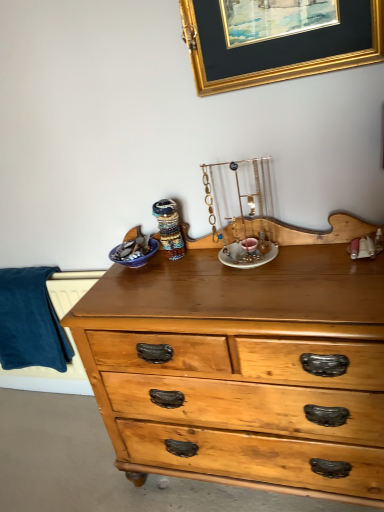
What is the approximate width of gold/glossy picture frame at upper center?

The width of gold/glossy picture frame at upper center is 2.65 inches.

The width and height of the screenshot is (384, 512). Describe the element at coordinates (278, 39) in the screenshot. I see `gold/glossy picture frame at upper center` at that location.

I want to click on gold/glossy picture frame at upper center, so click(278, 39).

Where is `blue soft fabric at left`? This screenshot has width=384, height=512. blue soft fabric at left is located at coordinates pos(30,321).

Describe the element at coordinates (30, 321) in the screenshot. I see `blue soft fabric at left` at that location.

Identify the location of gold/glossy picture frame at upper center. (278, 39).

Which is more to the right, blue soft fabric at left or gold/glossy picture frame at upper center?

gold/glossy picture frame at upper center.

Is the depth of blue soft fabric at left less than that of gold/glossy picture frame at upper center?

That is False.

Between point (19, 330) and point (196, 87), which one is positioned in front?

Point (196, 87)

From the image's perspective, is blue soft fabric at left positioned above or below gold/glossy picture frame at upper center?

Based on their image positions, blue soft fabric at left is located beneath gold/glossy picture frame at upper center.

From a real-world perspective, is blue soft fabric at left positioned above or below gold/glossy picture frame at upper center?

blue soft fabric at left is situated lower than gold/glossy picture frame at upper center in the real world.

Does blue soft fabric at left have a greater width compared to gold/glossy picture frame at upper center?

Yes, blue soft fabric at left is wider than gold/glossy picture frame at upper center.

Between blue soft fabric at left and gold/glossy picture frame at upper center, which one has less height?

gold/glossy picture frame at upper center.

Considering the relative sizes of blue soft fabric at left and gold/glossy picture frame at upper center in the image provided, is blue soft fabric at left smaller than gold/glossy picture frame at upper center?

No, blue soft fabric at left is not smaller than gold/glossy picture frame at upper center.

Is blue soft fabric at left inside or outside of gold/glossy picture frame at upper center?

blue soft fabric at left is not inside gold/glossy picture frame at upper center, it's outside.

Are blue soft fabric at left and gold/glossy picture frame at upper center far apart?

Yes.

Is blue soft fabric at left aimed at gold/glossy picture frame at upper center?

No, blue soft fabric at left is not turned towards gold/glossy picture frame at upper center.

How many degrees apart are the facing directions of blue soft fabric at left and gold/glossy picture frame at upper center?

The angle between the facing direction of blue soft fabric at left and the facing direction of gold/glossy picture frame at upper center is 0.00813 degrees.

You are a GUI agent. You are given a task and a screenshot of the screen. Output one action in this format:
    pyautogui.click(x=<x>, y=<y>)
    Task: Click on the blanket below the gold/glossy picture frame at upper center (from a real-world perspective)
    The width and height of the screenshot is (384, 512).
    Given the screenshot: What is the action you would take?
    pyautogui.click(x=30, y=321)

Can you confirm if gold/glossy picture frame at upper center is positioned to the right of blue soft fabric at left?

Yes, gold/glossy picture frame at upper center is to the right of blue soft fabric at left.

Which object is further away from the camera, gold/glossy picture frame at upper center or blue soft fabric at left?

blue soft fabric at left is behind.

Consider the image. Which point is more forward, (277, 3) or (35, 330)?

Point (277, 3)

From the image's perspective, is gold/glossy picture frame at upper center on blue soft fabric at left?

Yes, from the image's perspective, gold/glossy picture frame at upper center is on top of blue soft fabric at left.

From a real-world perspective, does gold/glossy picture frame at upper center sit lower than blue soft fabric at left?

No, from a real-world perspective, gold/glossy picture frame at upper center is not under blue soft fabric at left.

Considering the sizes of objects gold/glossy picture frame at upper center and blue soft fabric at left in the image provided, who is wider, gold/glossy picture frame at upper center or blue soft fabric at left?

Wider between the two is blue soft fabric at left.

Considering the sizes of objects gold/glossy picture frame at upper center and blue soft fabric at left in the image provided, who is shorter, gold/glossy picture frame at upper center or blue soft fabric at left?

Standing shorter between the two is gold/glossy picture frame at upper center.

Considering the sizes of gold/glossy picture frame at upper center and blue soft fabric at left in the image, is gold/glossy picture frame at upper center bigger or smaller than blue soft fabric at left?

gold/glossy picture frame at upper center is smaller than blue soft fabric at left.

Can we say gold/glossy picture frame at upper center lies outside blue soft fabric at left?

gold/glossy picture frame at upper center is positioned outside blue soft fabric at left.

Consider the image. Are gold/glossy picture frame at upper center and blue soft fabric at left making contact?

No, gold/glossy picture frame at upper center is not touching blue soft fabric at left.

Is gold/glossy picture frame at upper center oriented towards blue soft fabric at left?

No, gold/glossy picture frame at upper center is not facing towards blue soft fabric at left.

What's the angular difference between gold/glossy picture frame at upper center and blue soft fabric at left's facing directions?

0.00813 degrees.

How far apart are gold/glossy picture frame at upper center and blue soft fabric at left?

They are 4.00 feet apart.

The height and width of the screenshot is (512, 384). What are the coordinates of `picture frame lying above the blue soft fabric at left (from the image's perspective)` in the screenshot? It's located at (278, 39).

The image size is (384, 512). I want to click on blanket below the gold/glossy picture frame at upper center (from a real-world perspective), so click(x=30, y=321).

Locate an element on the screen. The image size is (384, 512). picture frame above the blue soft fabric at left (from a real-world perspective) is located at coordinates (278, 39).